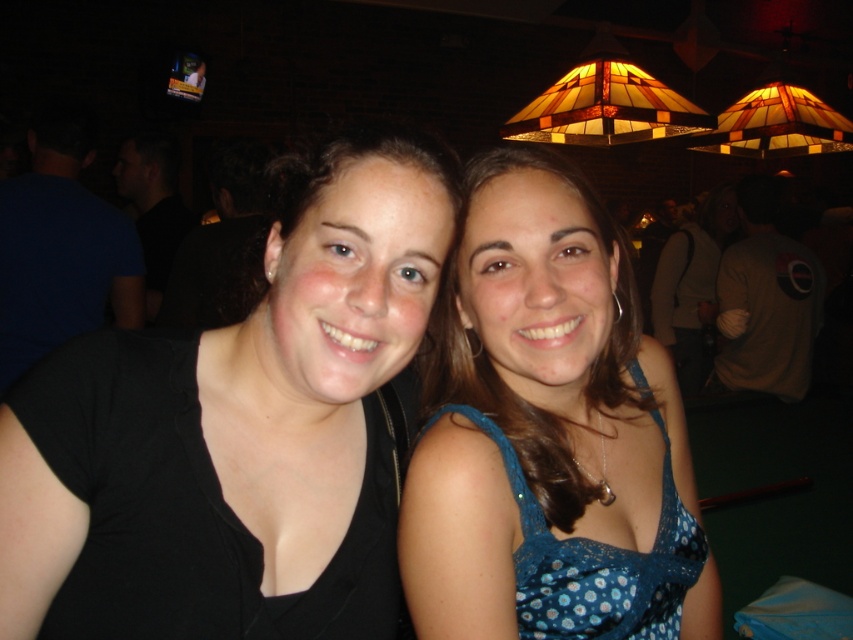
You are standing in the image and want to locate the black matte shirt at left. Can you tell me its 2D coordinates in the image?

The 2D coordinates of the black matte shirt at left are at point (238, 426).